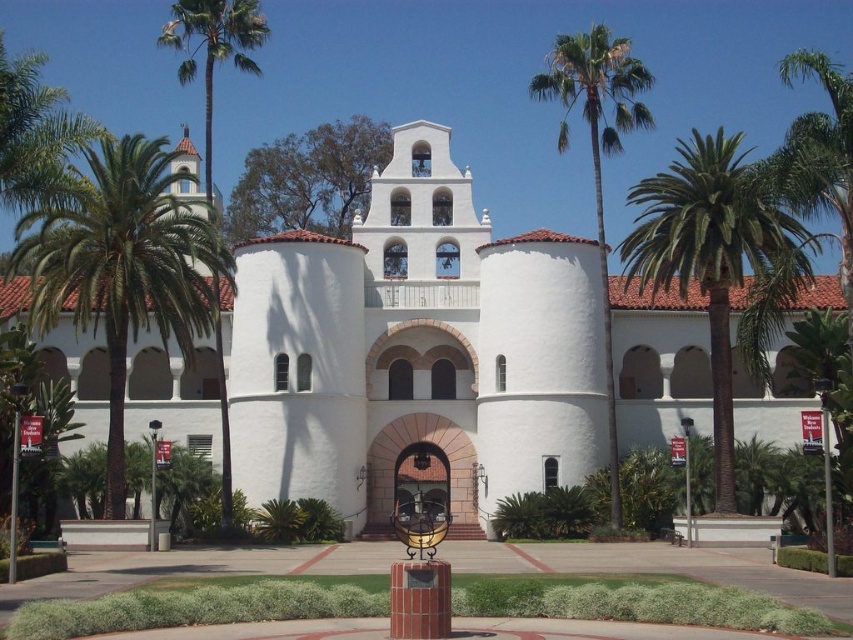
Question: Considering the relative positions of white stucco building at center and green leafy palm tree at right in the image provided, where is white stucco building at center located with respect to green leafy palm tree at right?

Choices:
 (A) below
 (B) above

Answer: (A)

Question: Which point is closer to the camera?

Choices:
 (A) green leafy palm tree at right
 (B) white stucco building at center

Answer: (A)

Question: Observing the image, what is the correct spatial positioning of green leafy palm tree at right in reference to green leafy palm tree at upper right?

Choices:
 (A) below
 (B) above

Answer: (A)

Question: Which point is closer to the camera?

Choices:
 (A) green leafy palm tree at upper right
 (B) white stucco building at center

Answer: (A)

Question: Which point is closer to the camera taking this photo?

Choices:
 (A) (697, 189)
 (B) (239, 397)
 (C) (544, 96)

Answer: (A)

Question: Can you confirm if white stucco building at center is positioned to the left of green leafy palm tree at right?

Choices:
 (A) yes
 (B) no

Answer: (A)